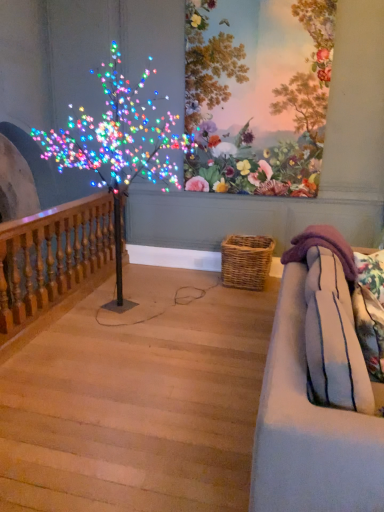
Identify the location of vacant position to the left of woven brown basket at lower center. (192, 284).